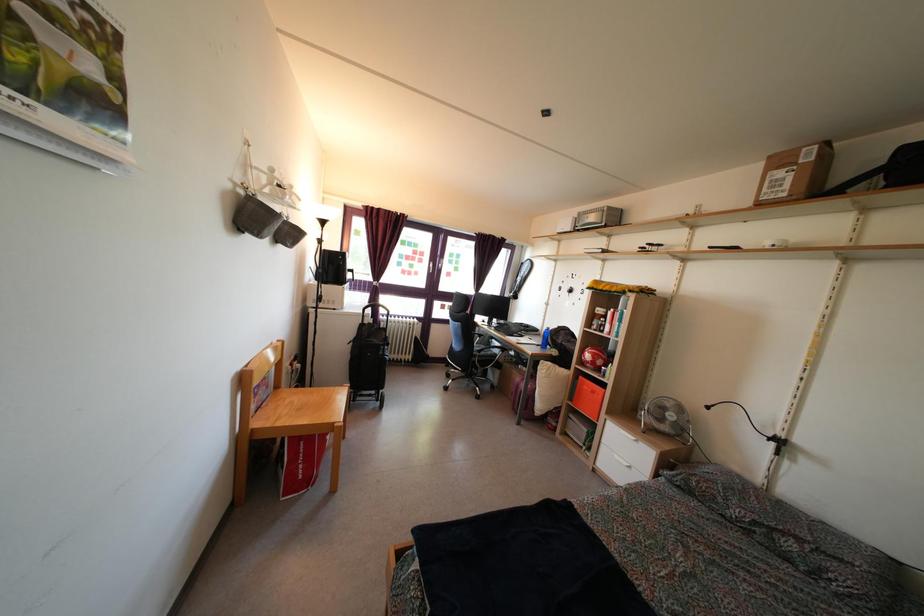
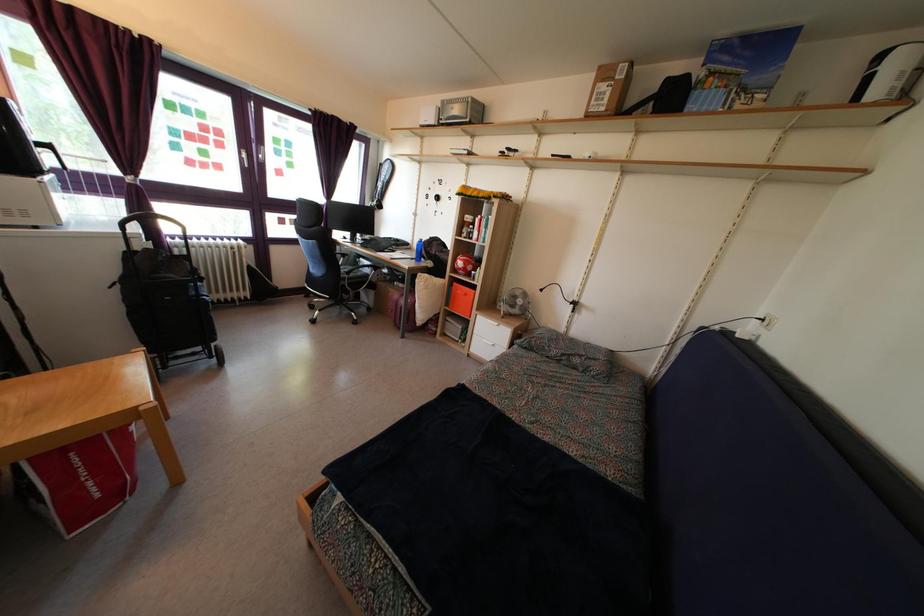
The point at [596,400] is marked in the first image. Where is the corresponding point in the second image?

(468, 302)